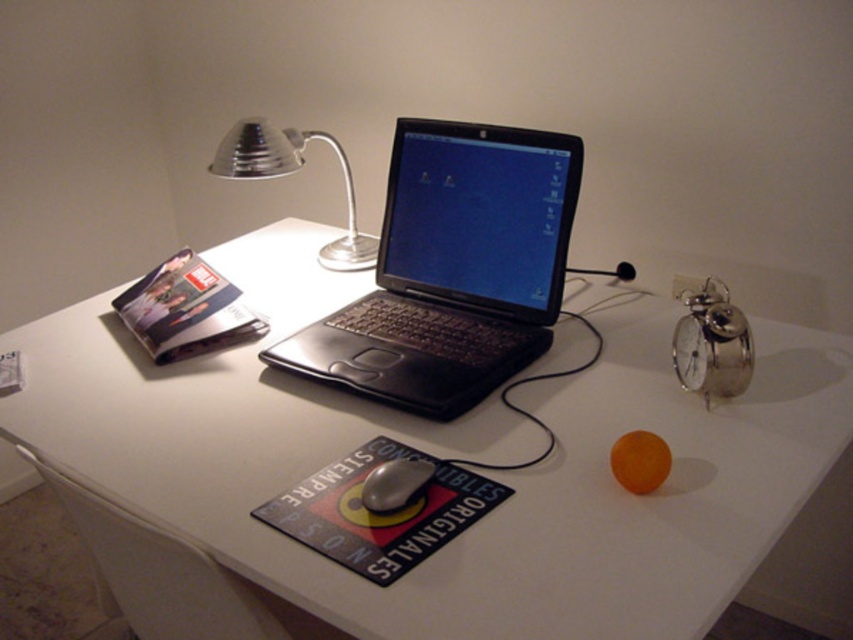
Does satin silver desk lamp at upper center have a greater height compared to silver metallic alarm clock at upper right?

Correct, satin silver desk lamp at upper center is much taller as silver metallic alarm clock at upper right.

Is point (374, 243) positioned in front of point (683, 372)?

No, (374, 243) is behind (683, 372).

What do you see at coordinates (289, 173) in the screenshot? I see `satin silver desk lamp at upper center` at bounding box center [289, 173].

This screenshot has width=853, height=640. What are the coordinates of `satin silver desk lamp at upper center` in the screenshot? It's located at (289, 173).

At what (x,y) coordinates should I click in order to perform the action: click on white glossy table at center. Please return your answer as a coordinate pair (x, y). Looking at the image, I should click on (463, 456).

Who is lower down, white glossy table at center or black matte laptop at center?

white glossy table at center is lower down.

Between point (401, 436) and point (474, 180), which one is positioned in front?

Point (401, 436) is more forward.

Where is `white glossy table at center`? Image resolution: width=853 pixels, height=640 pixels. white glossy table at center is located at coordinates (463, 456).

What are the coordinates of `black matte laptop at center` in the screenshot? It's located at (453, 269).

Identify the location of black matte laptop at center. This screenshot has width=853, height=640. (453, 269).

You are a GUI agent. You are given a task and a screenshot of the screen. Output one action in this format:
    pyautogui.click(x=<x>, y=<y>)
    Task: Click on the black matte laptop at center
    
    Given the screenshot: What is the action you would take?
    pyautogui.click(x=453, y=269)